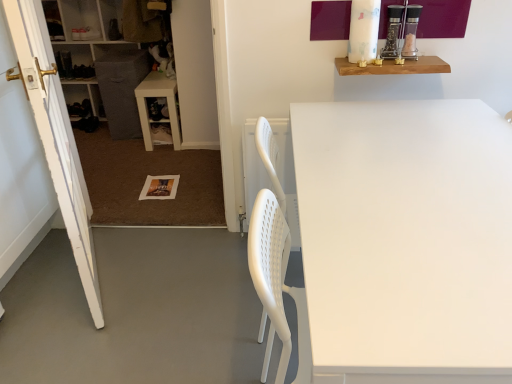
Question: Does white painted wood door at left come behind white matte table at center, which appears as the first table when ordered from the bottom?

Choices:
 (A) no
 (B) yes

Answer: (B)

Question: From a real-world perspective, is white painted wood door at left positioned under white matte table at center, the 1th table positioned from the front, based on gravity?

Choices:
 (A) yes
 (B) no

Answer: (B)

Question: From a real-world perspective, is white painted wood door at left located higher than white matte table at center, placed as the 2th table when sorted from left to right?

Choices:
 (A) no
 (B) yes

Answer: (B)

Question: Does white painted wood door at left have a larger size compared to white matte table at center, the first table from the right?

Choices:
 (A) no
 (B) yes

Answer: (A)

Question: Is there a large distance between white painted wood door at left and white matte table at center, the first table from the right?

Choices:
 (A) no
 (B) yes

Answer: (B)

Question: From a real-world perspective, is white painted wood door at left above or below white plastic table at lower left, the 1th table from the left?

Choices:
 (A) below
 (B) above

Answer: (B)

Question: Considering the positions of white painted wood door at left and white plastic table at lower left, which is counted as the first table, starting from the back, in the image, is white painted wood door at left taller or shorter than white plastic table at lower left, which is counted as the first table, starting from the back,?

Choices:
 (A) tall
 (B) short

Answer: (A)

Question: Is white painted wood door at left inside or outside of white plastic table at lower left, which is counted as the 2th table, starting from the right?

Choices:
 (A) inside
 (B) outside

Answer: (B)

Question: From the image's perspective, is white painted wood door at left positioned above or below white plastic table at lower left, the 2th table positioned from the bottom?

Choices:
 (A) below
 (B) above

Answer: (A)

Question: In terms of height, does wooden shelf at upper right look taller or shorter compared to white painted wood door at left?

Choices:
 (A) short
 (B) tall

Answer: (A)

Question: Considering the positions of point (391, 72) and point (48, 69), is point (391, 72) closer or farther from the camera than point (48, 69)?

Choices:
 (A) closer
 (B) farther

Answer: (A)

Question: Is wooden shelf at upper right in front of or behind white painted wood door at left in the image?

Choices:
 (A) front
 (B) behind

Answer: (B)

Question: Would you say wooden shelf at upper right is inside or outside white painted wood door at left?

Choices:
 (A) inside
 (B) outside

Answer: (B)

Question: Does point (441, 294) appear closer or farther from the camera than point (13, 21)?

Choices:
 (A) closer
 (B) farther

Answer: (A)

Question: In terms of width, does white matte table at center, placed as the 2th table when sorted from left to right, look wider or thinner when compared to white painted wood door at left?

Choices:
 (A) wide
 (B) thin

Answer: (A)